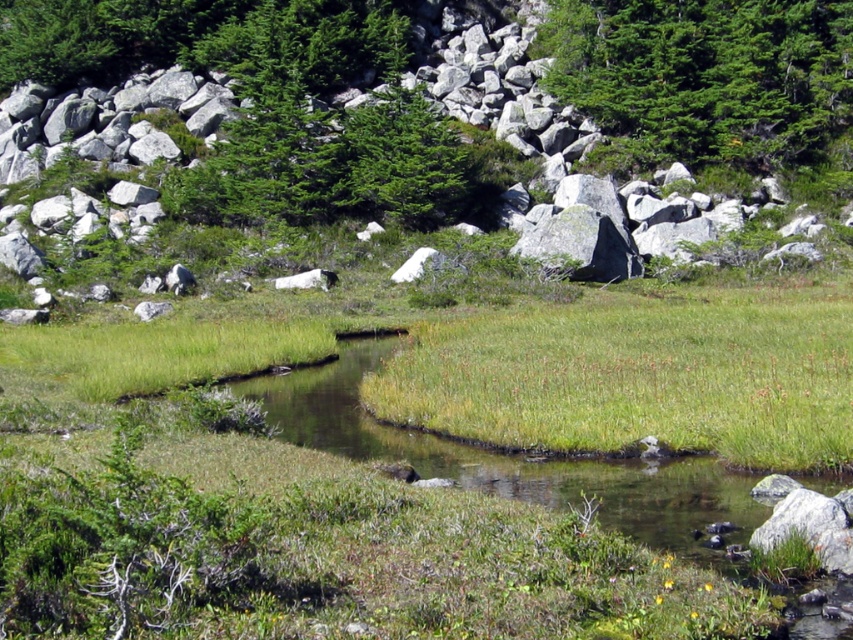
Between green grassy at center and green matte tree at upper center, which one is positioned higher?

green matte tree at upper center

How distant is green grassy at center from green matte tree at upper center?

green grassy at center and green matte tree at upper center are 18.16 meters apart.

Which is behind, point (601, 404) or point (688, 4)?

Positioned behind is point (688, 4).

Identify the location of green grassy at center. (639, 376).